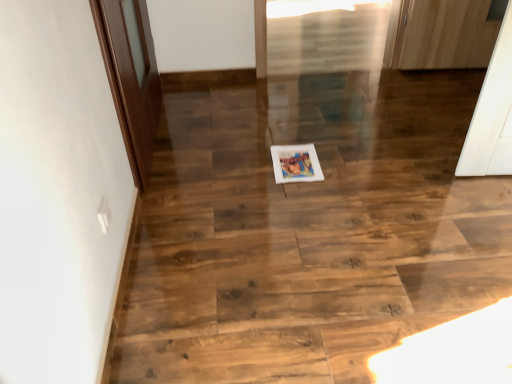
Question: Is wooden floor at center further to camera compared to brown wooden door at left?

Choices:
 (A) no
 (B) yes

Answer: (A)

Question: Is wooden floor at center outside of brown wooden door at left?

Choices:
 (A) yes
 (B) no

Answer: (A)

Question: Is wooden floor at center smaller than brown wooden door at left?

Choices:
 (A) no
 (B) yes

Answer: (B)

Question: Considering the relative sizes of wooden floor at center and brown wooden door at left in the image provided, is wooden floor at center thinner than brown wooden door at left?

Choices:
 (A) no
 (B) yes

Answer: (A)

Question: Considering the relative sizes of wooden floor at center and brown wooden door at left in the image provided, is wooden floor at center wider than brown wooden door at left?

Choices:
 (A) yes
 (B) no

Answer: (A)

Question: From a real-world perspective, is wooden floor at center located beneath brown wooden door at left?

Choices:
 (A) no
 (B) yes

Answer: (B)

Question: Does wooden floor at center lie behind matte paper postcard at center?

Choices:
 (A) yes
 (B) no

Answer: (B)

Question: Would you say matte paper postcard at center is part of wooden floor at center's contents?

Choices:
 (A) no
 (B) yes

Answer: (A)

Question: Is wooden floor at center positioned beyond the bounds of matte paper postcard at center?

Choices:
 (A) no
 (B) yes

Answer: (B)

Question: From a real-world perspective, is wooden floor at center over matte paper postcard at center?

Choices:
 (A) yes
 (B) no

Answer: (B)

Question: Is wooden floor at center not close to matte paper postcard at center?

Choices:
 (A) yes
 (B) no

Answer: (B)

Question: Is wooden floor at center directly adjacent to matte paper postcard at center?

Choices:
 (A) no
 (B) yes

Answer: (A)

Question: Can you confirm if brown wooden door at left is wider than wooden floor at center?

Choices:
 (A) yes
 (B) no

Answer: (B)